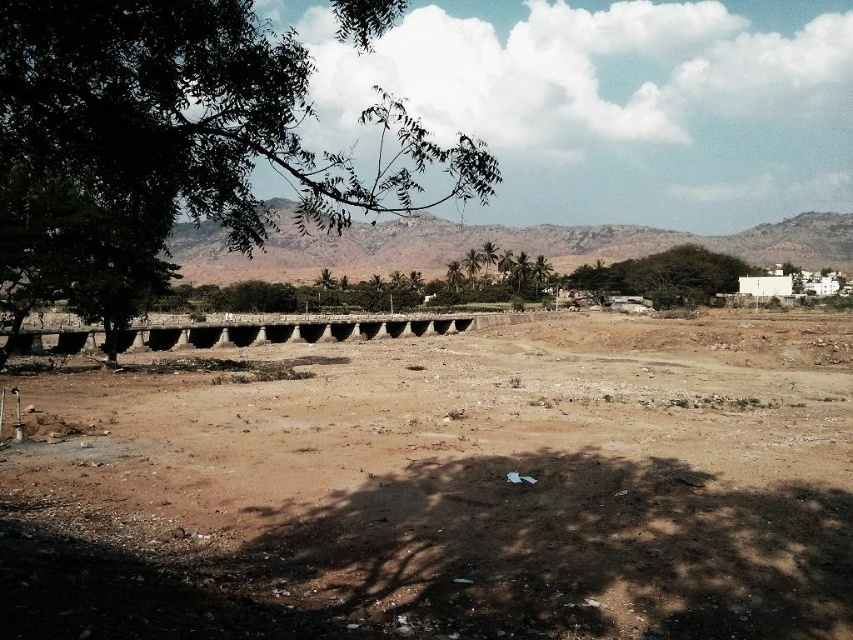
Question: Which object is farther from the camera taking this photo?

Choices:
 (A) green leafy tree at left
 (B) brown sandy dirt field at center

Answer: (A)

Question: Can you confirm if brown sandy dirt field at center is smaller than green leafy tree at left?

Choices:
 (A) no
 (B) yes

Answer: (B)

Question: Can you confirm if brown sandy dirt field at center is positioned above green leafy tree at left?

Choices:
 (A) yes
 (B) no

Answer: (B)

Question: Can you confirm if brown sandy dirt field at center is bigger than green leafy tree at left?

Choices:
 (A) yes
 (B) no

Answer: (B)

Question: Among these objects, which one is nearest to the camera?

Choices:
 (A) brown sandy dirt field at center
 (B) green leafy tree at left

Answer: (A)